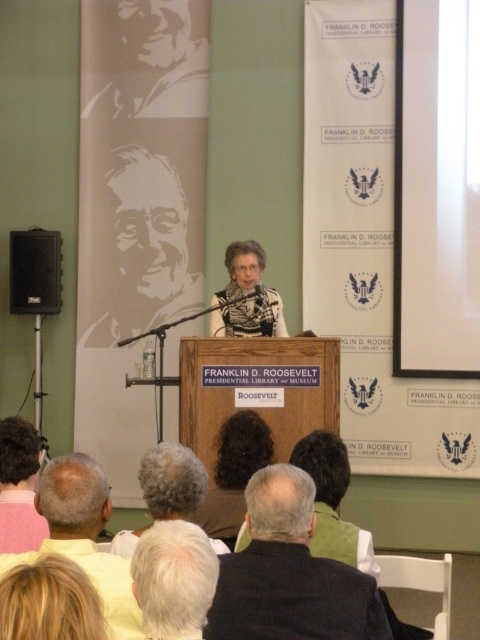
Which is more to the left, silhouette paper portrait at upper left or black plastic speaker at left?

black plastic speaker at left

Which of these two, silhouette paper portrait at upper left or black plastic speaker at left, stands taller?

silhouette paper portrait at upper left

In order to click on silhouette paper portrait at upper left in this screenshot , I will do `click(147, 56)`.

Where is `silhouette paper portrait at upper left`? The width and height of the screenshot is (480, 640). silhouette paper portrait at upper left is located at coordinates (147, 56).

Who is higher up, gray matte portrait at upper left or dark brown hair at center?

gray matte portrait at upper left is higher up.

Looking at this image, can you confirm if gray matte portrait at upper left is thinner than dark brown hair at center?

In fact, gray matte portrait at upper left might be wider than dark brown hair at center.

Who is more forward, (x=197, y=307) or (x=256, y=449)?

Point (x=256, y=449)

The image size is (480, 640). Find the location of `gray matte portrait at upper left`. gray matte portrait at upper left is located at coordinates (140, 252).

Between dark gray hair at center and gray hair at center, which one has less height?

Standing shorter between the two is gray hair at center.

Who is lower down, dark gray hair at center or gray hair at center?

dark gray hair at center is lower down.

Between point (334, 518) and point (196, 496), which one is positioned behind?

The point (334, 518) is behind.

Locate an element on the screen. This screenshot has width=480, height=640. dark gray hair at center is located at coordinates (333, 500).